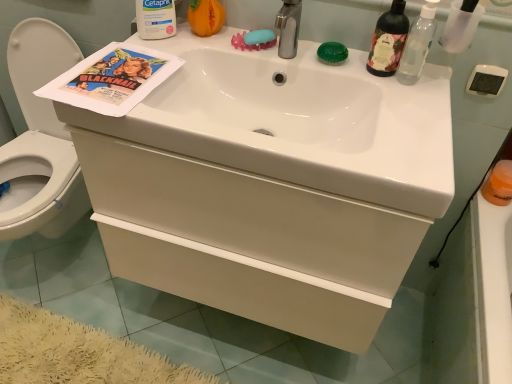
Identify the location of free space below white glossy toilet at left (from a real-world perspective). The width and height of the screenshot is (512, 384). (49, 259).